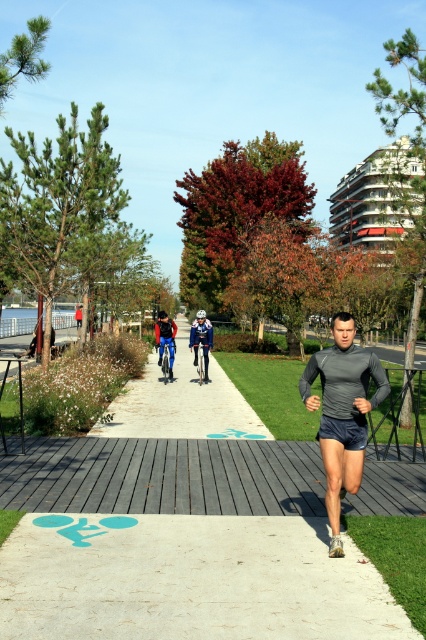
Is blue fabric at center shorter than dark gray/charcoal running suit at center?

Correct, blue fabric at center is not as tall as dark gray/charcoal running suit at center.

Which of these two, blue fabric at center or dark gray/charcoal running suit at center, stands taller?

dark gray/charcoal running suit at center is taller.

Who is more distant from viewer, (114, 419) or (365, 380)?

The point (114, 419) is behind.

Where is `blue fabric at center`? The width and height of the screenshot is (426, 640). blue fabric at center is located at coordinates [181, 403].